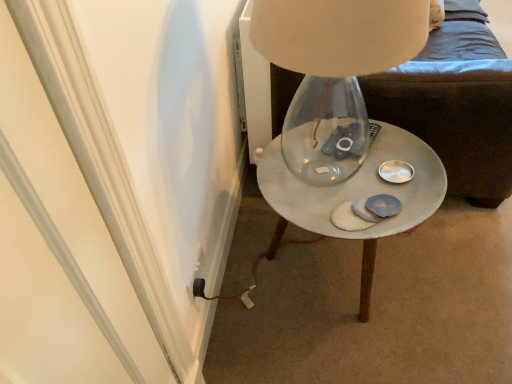
Question: From a real-world perspective, is black plastic outlet at lower left physically below white marble side table at center?

Choices:
 (A) no
 (B) yes

Answer: (B)

Question: Does black plastic outlet at lower left appear on the right side of white marble side table at center?

Choices:
 (A) yes
 (B) no

Answer: (B)

Question: Can you confirm if black plastic outlet at lower left is smaller than white marble side table at center?

Choices:
 (A) yes
 (B) no

Answer: (A)

Question: Does black plastic outlet at lower left have a lesser height compared to white marble side table at center?

Choices:
 (A) no
 (B) yes

Answer: (B)

Question: Is white marble side table at center completely or partially inside black plastic outlet at lower left?

Choices:
 (A) yes
 (B) no

Answer: (B)

Question: From a real-world perspective, relative to white marble side table at center, is black plastic outlet at lower left vertically above or below?

Choices:
 (A) below
 (B) above

Answer: (B)

Question: Is black plastic outlet at lower left situated inside white marble side table at center or outside?

Choices:
 (A) inside
 (B) outside

Answer: (B)

Question: Is black plastic outlet at lower left taller or shorter than white marble side table at center?

Choices:
 (A) short
 (B) tall

Answer: (A)

Question: Considering their positions, is black plastic outlet at lower left located in front of or behind white marble side table at center?

Choices:
 (A) front
 (B) behind

Answer: (B)

Question: Considering the positions of point click(x=400, y=216) and point click(x=443, y=150), is point click(x=400, y=216) closer or farther from the camera than point click(x=443, y=150)?

Choices:
 (A) farther
 (B) closer

Answer: (B)

Question: From a real-world perspective, is white marble side table at center physically located above or below white marble side table at center?

Choices:
 (A) above
 (B) below

Answer: (B)

Question: Is white marble side table at center wider or thinner than white marble side table at center?

Choices:
 (A) wide
 (B) thin

Answer: (A)

Question: Would you say white marble side table at center is to the left or to the right of white marble side table at center in the picture?

Choices:
 (A) left
 (B) right

Answer: (B)

Question: Looking at their shapes, would you say white marble side table at center is wider or thinner than black plastic outlet at lower left?

Choices:
 (A) wide
 (B) thin

Answer: (A)

Question: Considering their positions, is white marble side table at center located in front of or behind black plastic outlet at lower left?

Choices:
 (A) behind
 (B) front

Answer: (B)